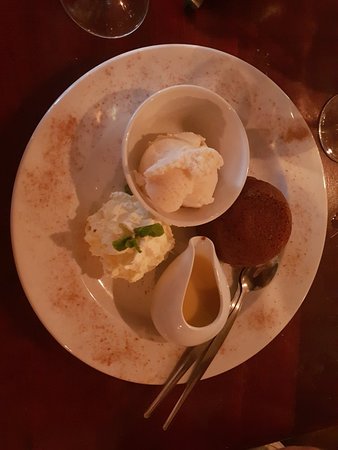
Identify the location of handle. The height and width of the screenshot is (450, 338). (163, 396).